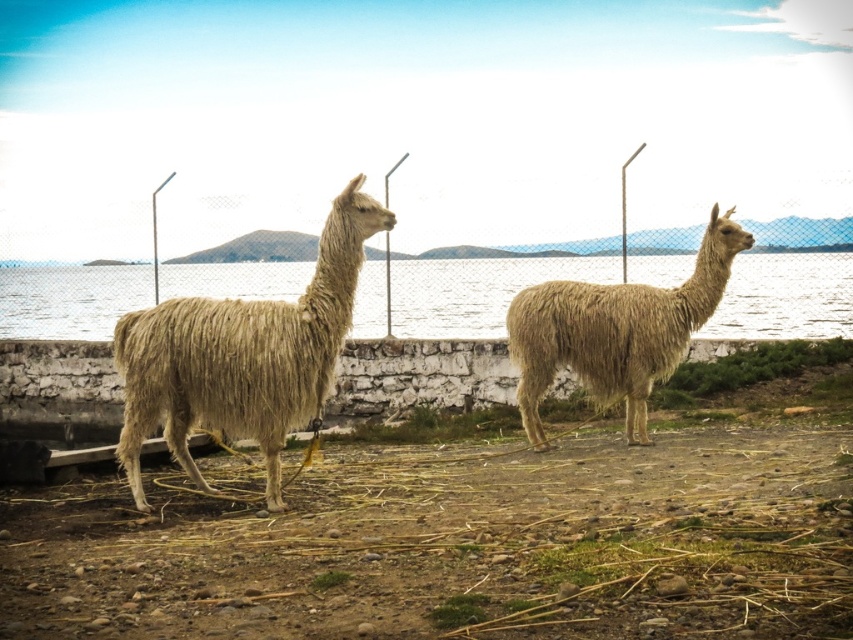
Can you confirm if clear blue water at center is positioned to the left of light beige woolen alpaca at center?

Incorrect, clear blue water at center is not on the left side of light beige woolen alpaca at center.

Is clear blue water at center taller than light beige woolen alpaca at center?

No.

This screenshot has height=640, width=853. What do you see at coordinates (476, 291) in the screenshot?
I see `clear blue water at center` at bounding box center [476, 291].

Find the location of a particular element. clear blue water at center is located at coordinates (476, 291).

Can you confirm if light beige woolen alpaca at center is thinner than beige woolen alpaca at right?

Indeed, light beige woolen alpaca at center has a lesser width compared to beige woolen alpaca at right.

Who is more distant from viewer, (326, 340) or (558, 336)?

The point (558, 336) is behind.

Image resolution: width=853 pixels, height=640 pixels. Identify the location of light beige woolen alpaca at center. (242, 355).

Who is positioned more to the right, clear blue water at center or beige woolen alpaca at right?

clear blue water at center is more to the right.

Locate an element on the screen. The image size is (853, 640). clear blue water at center is located at coordinates (476, 291).

Where is `clear blue water at center`? The width and height of the screenshot is (853, 640). clear blue water at center is located at coordinates (476, 291).